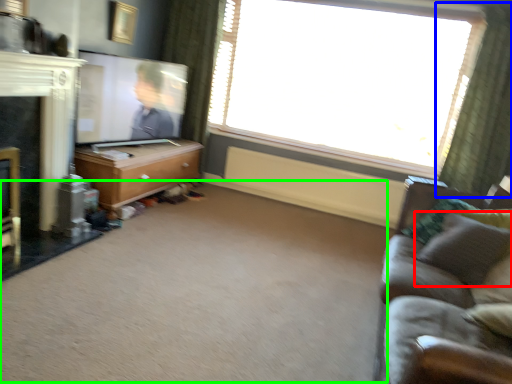
Question: Based on their relative distances, which object is farther from pillow (highlighted by a red box)? Choose from curtain (highlighted by a blue box) and plain (highlighted by a green box).

Choices:
 (A) curtain
 (B) plain

Answer: (A)